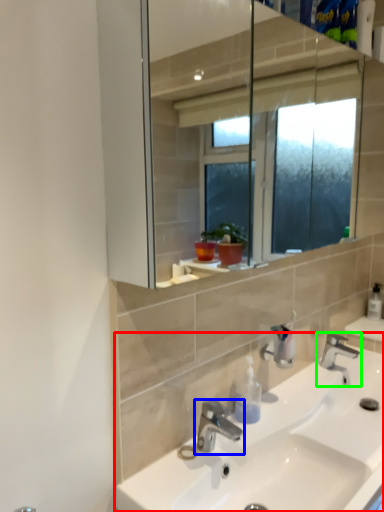
Question: Based on their relative distances, which object is farther from sink (highlighted by a red box)? Choose from tap (highlighted by a blue box) and tap (highlighted by a green box).

Choices:
 (A) tap
 (B) tap

Answer: (B)